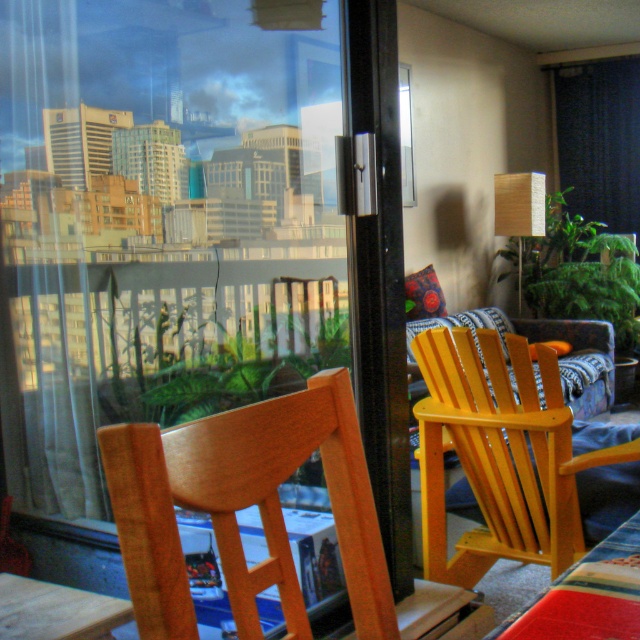
Question: Which point is farther to the camera?

Choices:
 (A) (560, 593)
 (B) (445, 340)

Answer: (B)

Question: In this image, where is transparent glass door at upper center located relative to wooden table at lower left?

Choices:
 (A) right
 (B) left

Answer: (A)

Question: Which object is positioned closest to the wooden table at lower right?

Choices:
 (A) wooden table at lower left
 (B) yellow wood chair at right

Answer: (A)

Question: Considering the relative positions of transparent glass door at upper center and wooden table at lower right in the image provided, where is transparent glass door at upper center located with respect to wooden table at lower right?

Choices:
 (A) below
 (B) above

Answer: (B)

Question: Which point appears farthest from the camera in this image?

Choices:
 (A) (618, 600)
 (B) (28, 604)
 (C) (557, 545)

Answer: (C)

Question: Can you confirm if wooden table at lower right is bigger than wooden table at lower left?

Choices:
 (A) yes
 (B) no

Answer: (B)